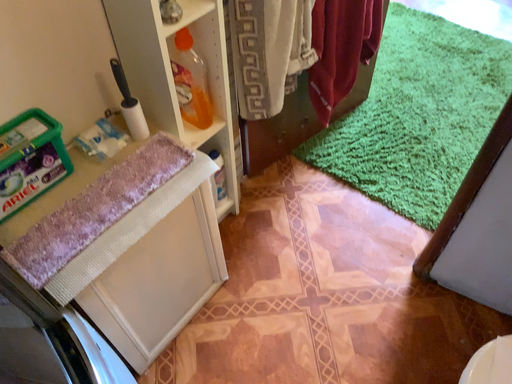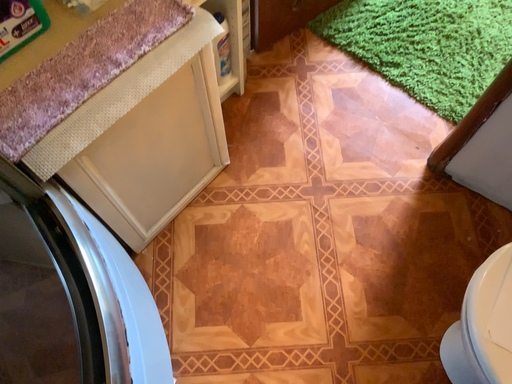
Question: How did the camera likely rotate when shooting the video?

Choices:
 (A) rotated downward
 (B) rotated upward

Answer: (A)